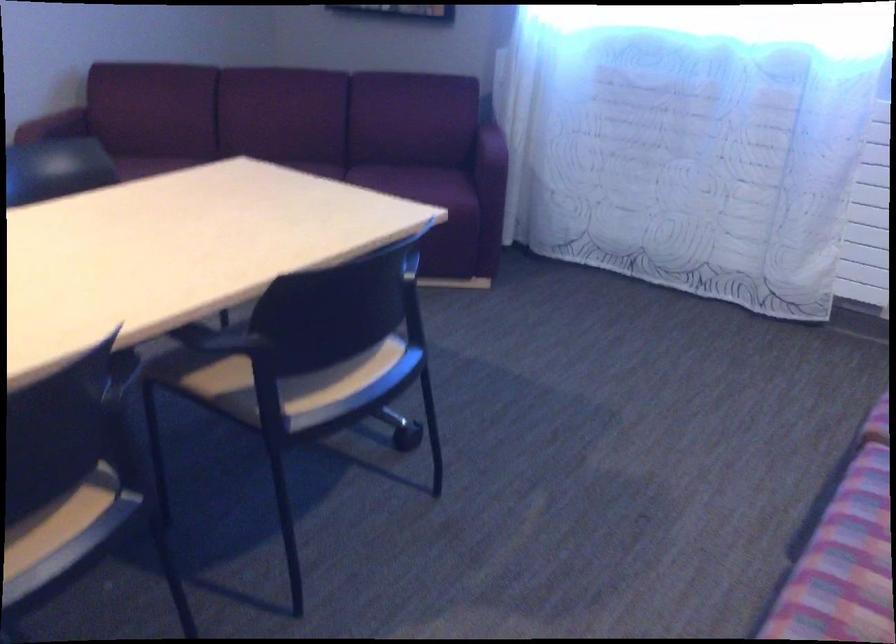
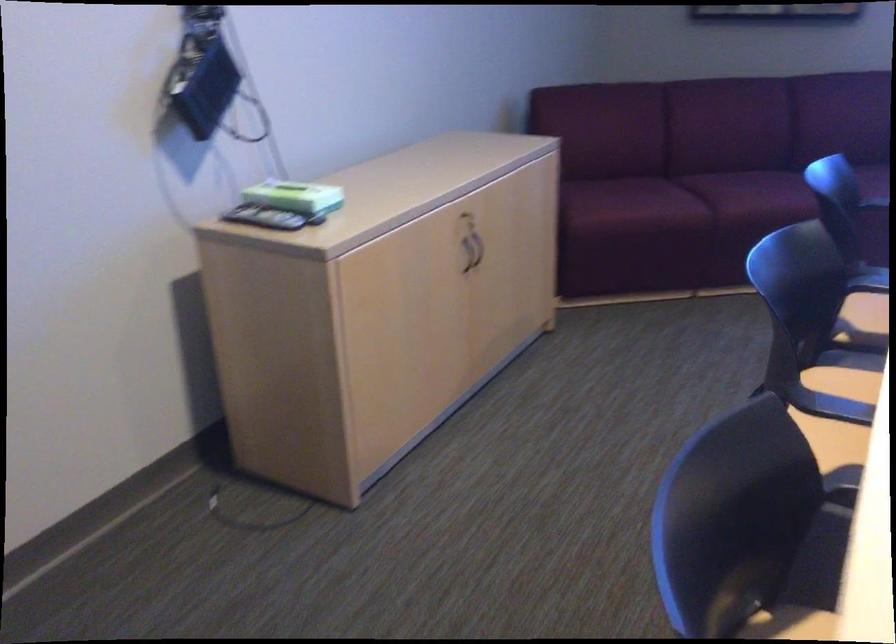
Question: I am providing you with two images of the same scene from different viewpoints. Which of the following objects are not visible in image2?

Choices:
 (A) sofa armrest
 (B) remote control
 (C) cabinet door handle
 (D) black adjustment lever

Answer: (A)